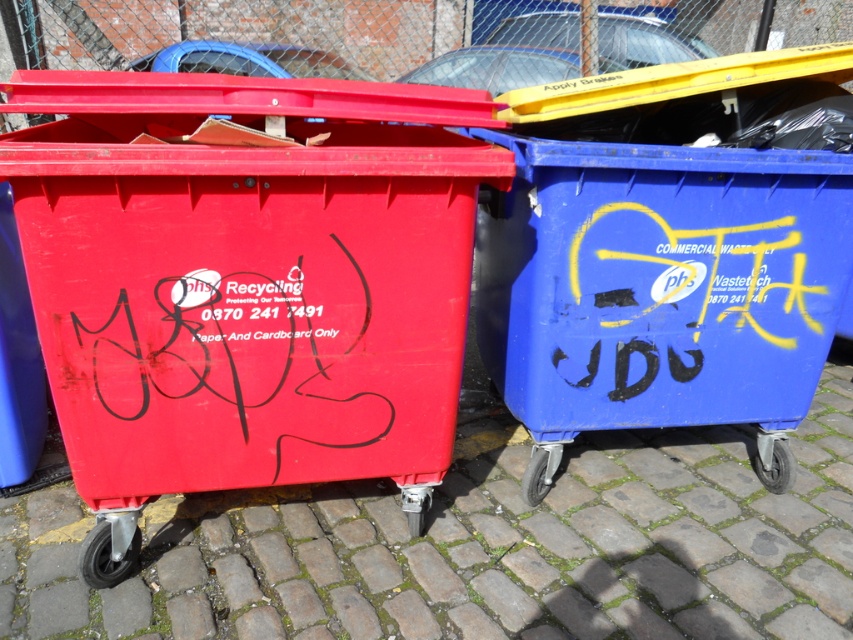
Is matte plastic recycling bin at left to the left of matte plastic bin at center from the viewer's perspective?

Yes, matte plastic recycling bin at left is to the left of matte plastic bin at center.

Where is `matte plastic recycling bin at left`? The width and height of the screenshot is (853, 640). matte plastic recycling bin at left is located at coordinates (245, 282).

In order to click on matte plastic recycling bin at left in this screenshot , I will do click(245, 282).

Locate an element on the screen. The width and height of the screenshot is (853, 640). matte plastic recycling bin at left is located at coordinates coord(245,282).

Between matte plastic recycling bin at left and cobblestone pavement at center, which one is positioned lower?

Positioned lower is cobblestone pavement at center.

Who is shorter, matte plastic recycling bin at left or cobblestone pavement at center?

cobblestone pavement at center is shorter.

Which is in front, point (53, 332) or point (663, 518)?

Point (53, 332) is more forward.

Identify the location of matte plastic recycling bin at left. (245, 282).

Is cobblestone pavement at center smaller than matte plastic bin at center?

Incorrect, cobblestone pavement at center is not smaller in size than matte plastic bin at center.

Who is more distant from viewer, (x=543, y=531) or (x=582, y=365)?

The point (x=543, y=531) is behind.

Between point (303, 570) and point (672, 324), which one is positioned behind?

The point (672, 324) is more distant.

Locate an element on the screen. Image resolution: width=853 pixels, height=640 pixels. cobblestone pavement at center is located at coordinates (476, 547).